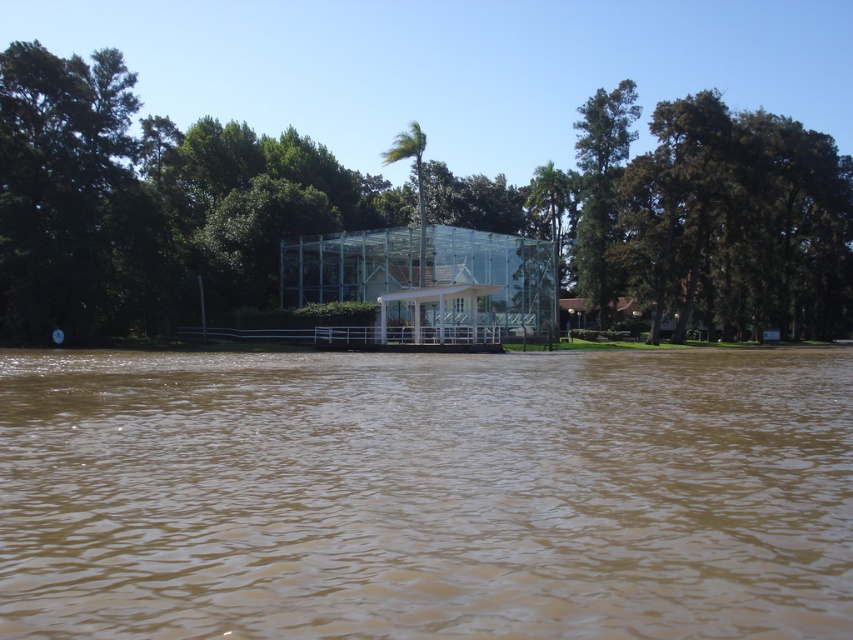
You are planning to plant a new tree in this outdoor area. Considering the existing green leafy tree at center and the green leafy tree at upper right, which one is shorter and might require more sunlight to grow taller?

The green leafy tree at center is shorter compared to the green leafy tree at upper right, so it might require more sunlight to grow taller.

You are a photographer standing at the camera position in the scene. You want to capture a photo of the green leafy tree at center. If your camera has a maximum focus range of 50 meters, will you be able to focus on the tree?

The distance between the green leafy tree at center and the camera is 52.83 meters, which exceeds the camera maximum focus range of 50 meters. Therefore, the camera cannot focus on the tree.